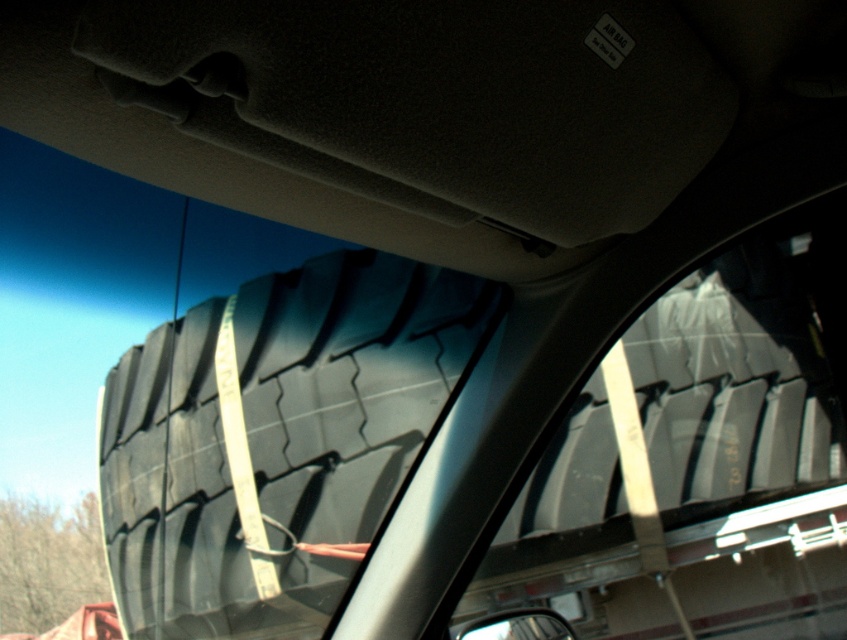
Does transparent plastic window at center appear under glossy plastic view mirror at lower center?

No.

Image resolution: width=847 pixels, height=640 pixels. I want to click on transparent plastic window at center, so click(702, 458).

Can you confirm if black rubber tire at center is taller than glossy plastic view mirror at lower center?

Yes, black rubber tire at center is taller than glossy plastic view mirror at lower center.

Who is more forward, (x=392, y=308) or (x=508, y=628)?

Point (x=508, y=628) is more forward.

Identify the location of black rubber tire at center. This screenshot has width=847, height=640. 275,438.

Does point (685, 317) come farther from viewer compared to point (236, 529)?

Yes, point (685, 317) is farther from viewer.

Does transparent plastic window at center have a larger size compared to black rubber tire at center?

Yes, transparent plastic window at center is bigger than black rubber tire at center.

The width and height of the screenshot is (847, 640). What do you see at coordinates (702, 458) in the screenshot?
I see `transparent plastic window at center` at bounding box center [702, 458].

Identify the location of transparent plastic window at center. This screenshot has width=847, height=640. (702, 458).